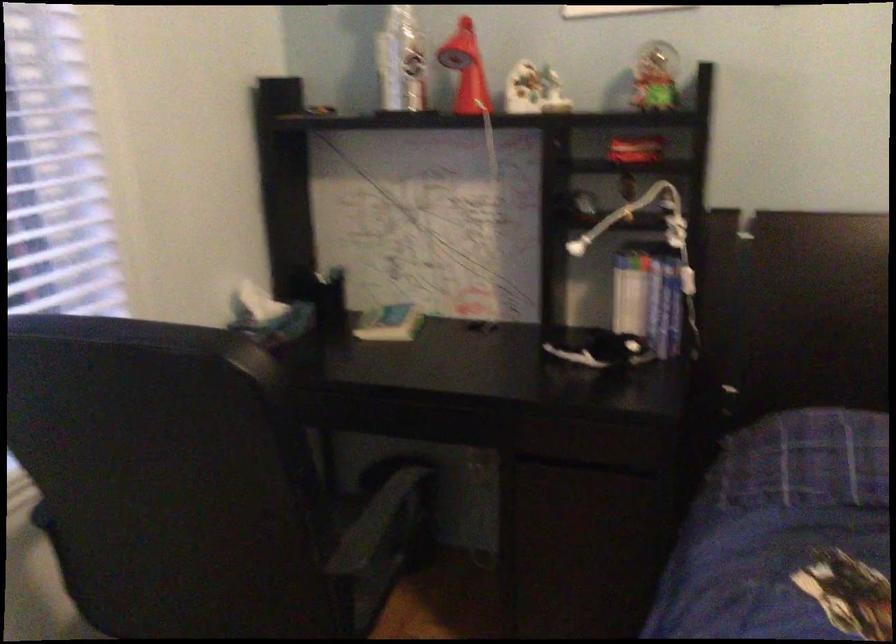
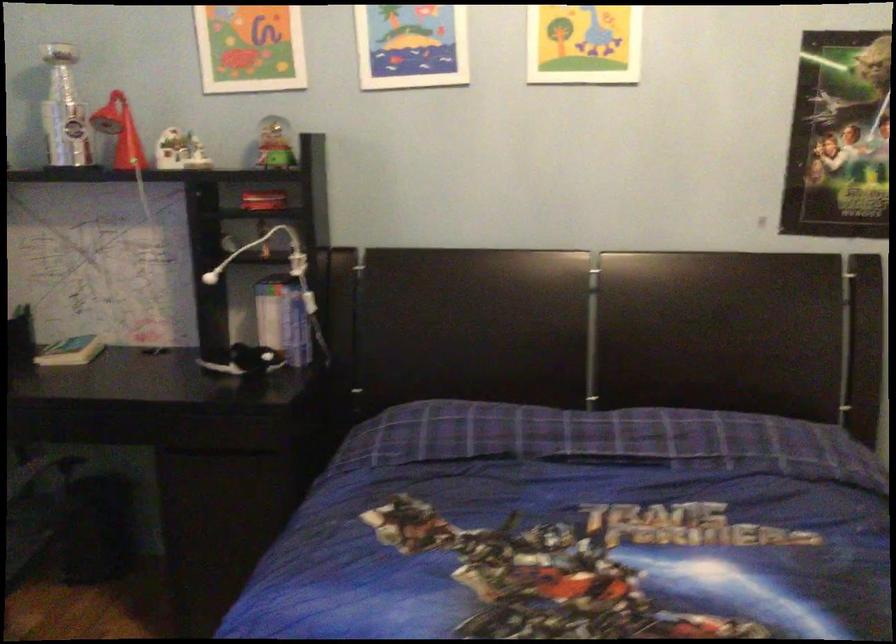
The images are taken continuously from a first-person perspective. In which direction are you moving?

The cameraman moved toward right, backward.